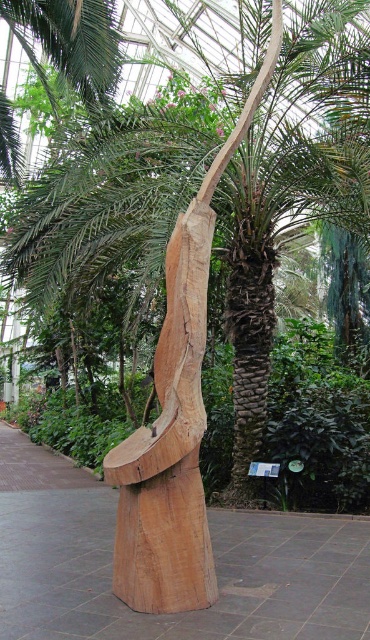
Does natural wood sculpture at center have a greater width compared to brown rough bark tree trunk at center?

Indeed, natural wood sculpture at center has a greater width compared to brown rough bark tree trunk at center.

Measure the distance between point [132,531] and camera.

Point [132,531] and camera are 12.05 feet apart.

Image resolution: width=370 pixels, height=640 pixels. In order to click on natural wood sculpture at center in this screenshot , I will do `click(169, 449)`.